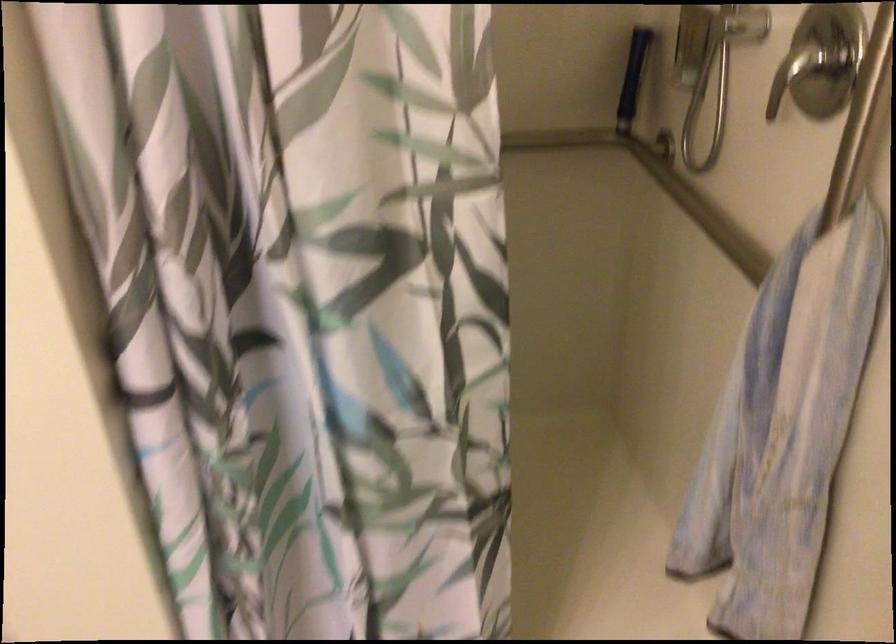
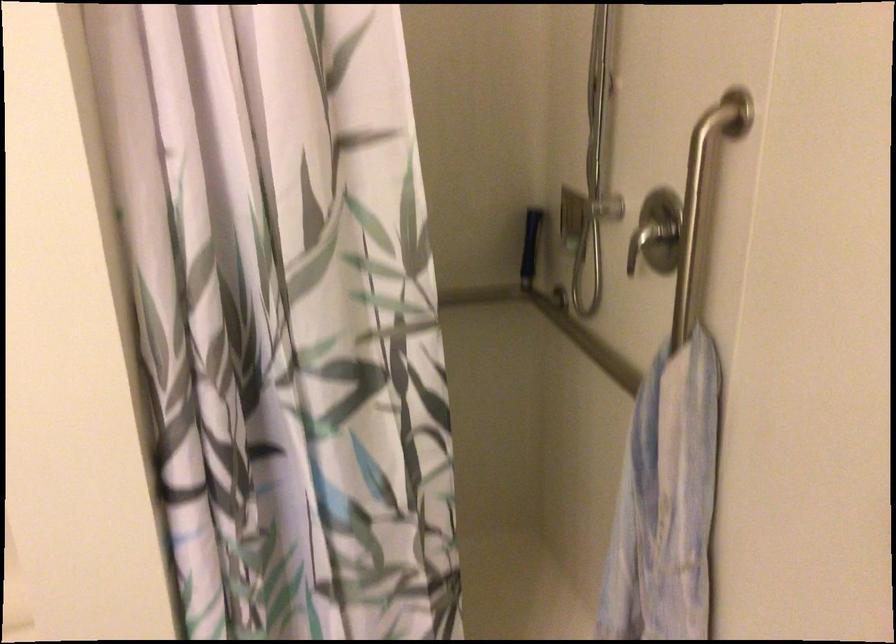
Question: In a continuous first-person perspective shot, in which direction is the camera moving?

Choices:
 (A) Left
 (B) Right
 (C) Forward
 (D) Backward

Answer: (D)